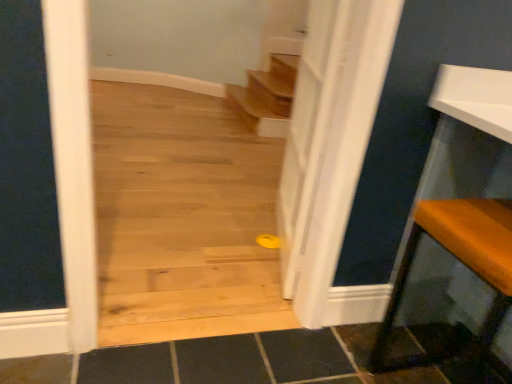
Measure the distance between white glossy door at center and camera.

A distance of 1.14 meters exists between white glossy door at center and camera.

This screenshot has width=512, height=384. What do you see at coordinates (332, 156) in the screenshot?
I see `white glossy door at center` at bounding box center [332, 156].

Measure the distance between point (x=358, y=92) and camera.

A distance of 1.26 meters exists between point (x=358, y=92) and camera.

Where is `white glossy door at center`? Image resolution: width=512 pixels, height=384 pixels. white glossy door at center is located at coordinates (332, 156).

Describe the element at coordinates (465, 265) in the screenshot. I see `orange fabric cushion at right` at that location.

Where is `orange fabric cushion at right`? orange fabric cushion at right is located at coordinates (465, 265).

At what (x,y) coordinates should I click in order to perform the action: click on white glossy door at center. Please return your answer as a coordinate pair (x, y). Looking at the image, I should click on (332, 156).

Does white glossy door at center appear on the left side of orange fabric cushion at right?

Yes.

Is white glossy door at center behind orange fabric cushion at right?

Yes, white glossy door at center is behind orange fabric cushion at right.

Between point (356, 131) and point (493, 365), which one is positioned in front?

The point (356, 131) is more forward.

From the image's perspective, which one is positioned lower, white glossy door at center or orange fabric cushion at right?

orange fabric cushion at right is shown below in the image.

From a real-world perspective, is white glossy door at center located higher than orange fabric cushion at right?

Indeed, from a real-world perspective, white glossy door at center stands above orange fabric cushion at right.

Looking at their sizes, would you say white glossy door at center is wider or thinner than orange fabric cushion at right?

Clearly, white glossy door at center has less width compared to orange fabric cushion at right.

Does white glossy door at center have a lesser height compared to orange fabric cushion at right?

No, white glossy door at center is not shorter than orange fabric cushion at right.

Does white glossy door at center have a smaller size compared to orange fabric cushion at right?

Correct, white glossy door at center occupies less space than orange fabric cushion at right.

Is white glossy door at center outside of orange fabric cushion at right?

Yes, white glossy door at center is not within orange fabric cushion at right.

Is white glossy door at center directly adjacent to orange fabric cushion at right?

They are not placed beside each other.

Is white glossy door at center facing away from orange fabric cushion at right?

That's not correct — white glossy door at center is not looking away from orange fabric cushion at right.

What's the angular difference between white glossy door at center and orange fabric cushion at right's facing directions?

165 degrees.

Measure the distance from white glossy door at center to orange fabric cushion at right.

They are 17.73 inches apart.

At what (x,y) coordinates should I click in order to perform the action: click on furniture that is in front of the white glossy door at center. Please return your answer as a coordinate pair (x, y). The width and height of the screenshot is (512, 384). Looking at the image, I should click on 465,265.

Considering the positions of objects orange fabric cushion at right and white glossy door at center in the image provided, who is more to the right, orange fabric cushion at right or white glossy door at center?

orange fabric cushion at right is more to the right.

Which object is more forward, orange fabric cushion at right or white glossy door at center?

orange fabric cushion at right.

Is point (503, 244) closer to camera compared to point (359, 167)?

Yes.

From the image's perspective, which is above, orange fabric cushion at right or white glossy door at center?

From the image's view, white glossy door at center is above.

From a real-world perspective, is orange fabric cushion at right physically above white glossy door at center?

No, from a real-world perspective, orange fabric cushion at right is not on top of white glossy door at center.

Between orange fabric cushion at right and white glossy door at center, which one has larger width?

With larger width is orange fabric cushion at right.

Can you confirm if orange fabric cushion at right is shorter than white glossy door at center?

Indeed, orange fabric cushion at right has a lesser height compared to white glossy door at center.

Is orange fabric cushion at right bigger than white glossy door at center?

Answer: Yes.

Is orange fabric cushion at right outside of white glossy door at center?

orange fabric cushion at right is positioned outside white glossy door at center.

Is orange fabric cushion at right next to white glossy door at center?

No, orange fabric cushion at right is not next to white glossy door at center.

Is orange fabric cushion at right oriented away from white glossy door at center?

No, orange fabric cushion at right's orientation is not away from white glossy door at center.

Can you tell me how much orange fabric cushion at right and white glossy door at center differ in facing direction?

The angular difference between orange fabric cushion at right and white glossy door at center is 165 degrees.

In order to click on door above the orange fabric cushion at right (from a real-world perspective) in this screenshot , I will do `click(332, 156)`.

Image resolution: width=512 pixels, height=384 pixels. I want to click on furniture that appears on the right of white glossy door at center, so click(465, 265).

Locate an element on the screen. The height and width of the screenshot is (384, 512). furniture below the white glossy door at center (from the image's perspective) is located at coordinates (465, 265).